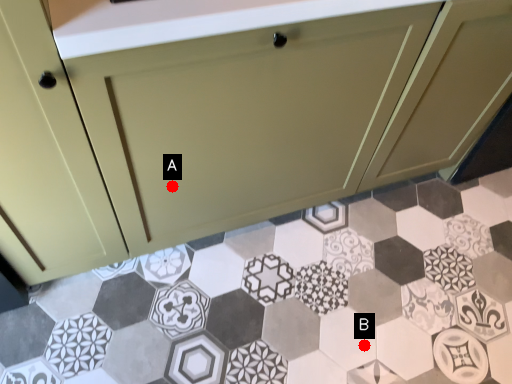
Question: Two points are circled on the image, labeled by A and B beside each circle. Which point is closer to the camera?

Choices:
 (A) A is closer
 (B) B is closer

Answer: (A)